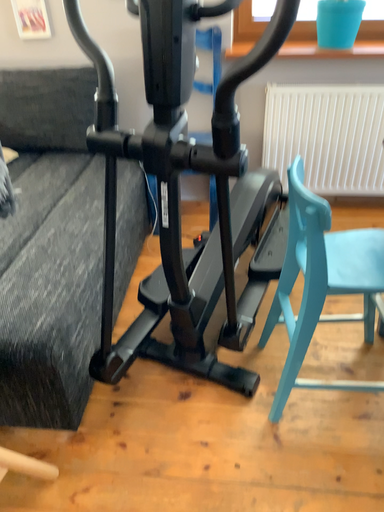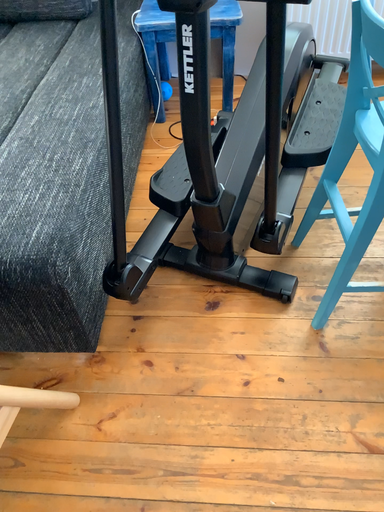
Question: How did the camera likely rotate when shooting the video?

Choices:
 (A) rotated upward
 (B) rotated downward

Answer: (B)